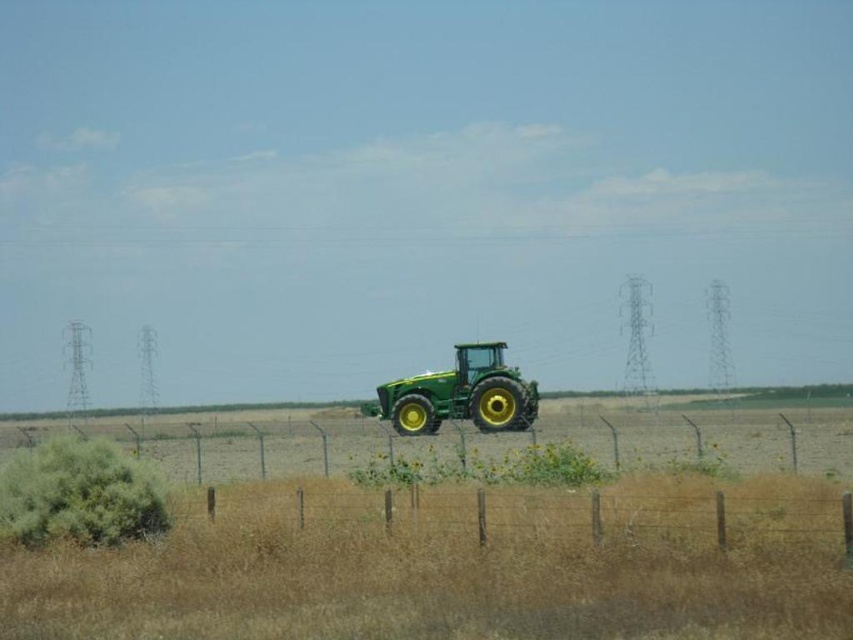
Question: Observing the image, what is the correct spatial positioning of brown dry grass at lower center in reference to brown wire fence at center?

Choices:
 (A) above
 (B) below

Answer: (A)

Question: Considering the real-world distances, which object is closest to the metal wire fence at center?

Choices:
 (A) green matte tractor at center
 (B) brown wire fence at center
 (C) brown dry grass at lower center

Answer: (A)

Question: Does brown wire fence at center appear on the right side of green matte tractor at center?

Choices:
 (A) no
 (B) yes

Answer: (B)

Question: Which object appears farthest from the camera in this image?

Choices:
 (A) green matte tractor at center
 (B) metal wire fence at center
 (C) brown dry grass at lower center
 (D) brown wire fence at center

Answer: (A)

Question: Is metal wire fence at center smaller than green matte tractor at center?

Choices:
 (A) no
 (B) yes

Answer: (A)

Question: Estimate the real-world distances between objects in this image. Which object is closer to the metal wire fence at center?

Choices:
 (A) green matte tractor at center
 (B) brown dry grass at lower center
 (C) brown wire fence at center

Answer: (A)